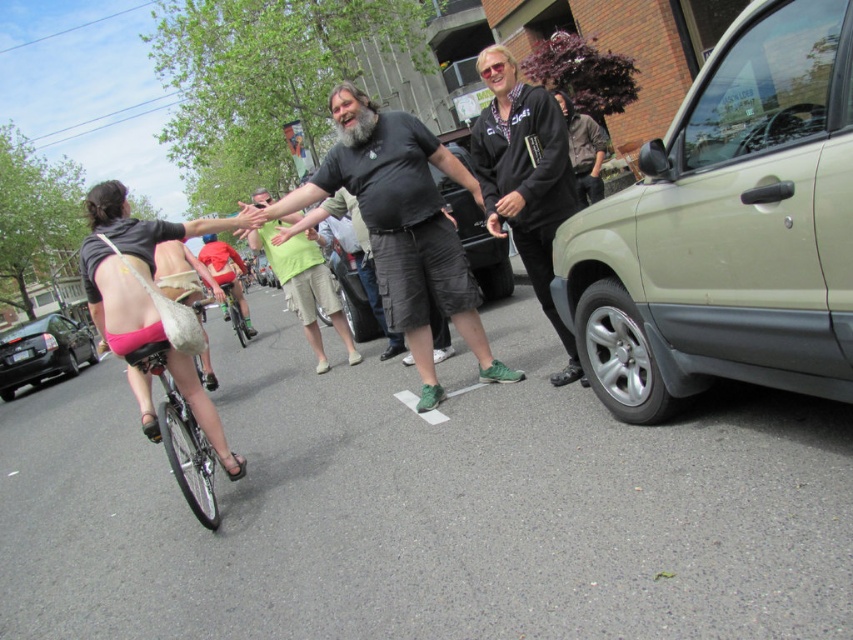
Is pink fabric shorts at left above green matte bicycle at center?

Incorrect, pink fabric shorts at left is not positioned above green matte bicycle at center.

Between pink fabric shorts at left and green matte bicycle at center, which one appears on the right side from the viewer's perspective?

From the viewer's perspective, pink fabric shorts at left appears more on the right side.

Where is `pink fabric shorts at left`? Image resolution: width=853 pixels, height=640 pixels. pink fabric shorts at left is located at coordinates (129, 264).

The width and height of the screenshot is (853, 640). What are the coordinates of `pink fabric shorts at left` in the screenshot? It's located at (129, 264).

Does black glossy car at left have a smaller size compared to green cotton shirt at center?

Indeed, black glossy car at left has a smaller size compared to green cotton shirt at center.

Which is in front, point (4, 358) or point (222, 244)?

Point (222, 244)

This screenshot has height=640, width=853. What are the coordinates of `black glossy car at left` in the screenshot? It's located at (42, 352).

Who is more distant from viewer, (187, 224) or (335, 320)?

Positioned behind is point (335, 320).

This screenshot has width=853, height=640. What do you see at coordinates (129, 264) in the screenshot?
I see `pink fabric shorts at left` at bounding box center [129, 264].

Find the location of `pink fabric shorts at left`. pink fabric shorts at left is located at coordinates (129, 264).